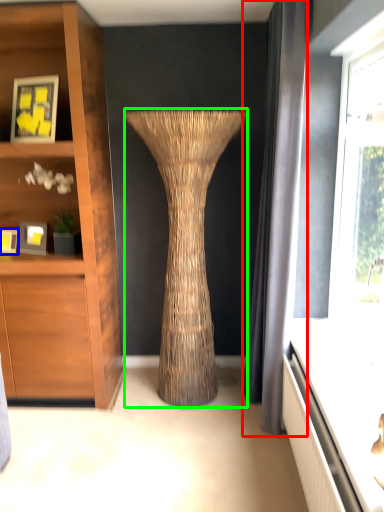
Question: Considering the real-world distances, which object is closest to curtain (highlighted by a red box)? picture frame (highlighted by a blue box) or vase (highlighted by a green box).

Choices:
 (A) picture frame
 (B) vase

Answer: (B)